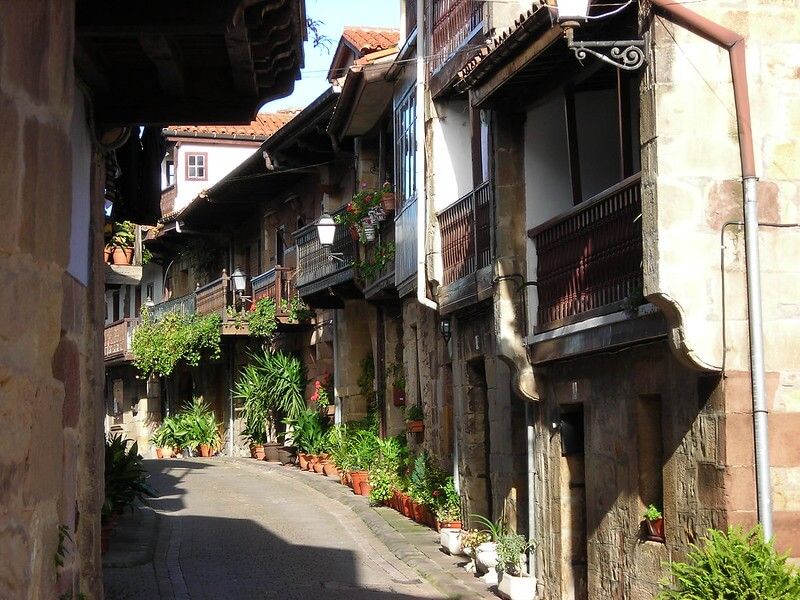
Where is `door`? The image size is (800, 600). door is located at coordinates (565, 479).